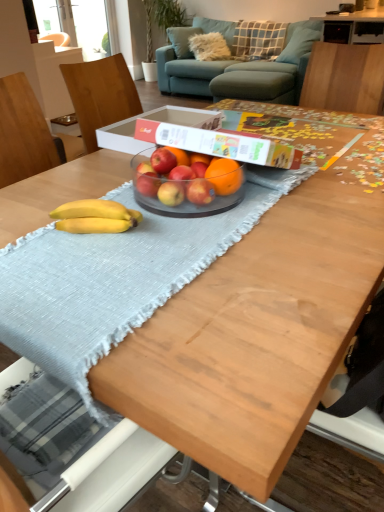
Question: From a real-world perspective, is blue fabric pillow at upper right, marked as the 1th pillow in a front-to-back arrangement, positioned under red matte apple at center, which is the second apple from left to right, based on gravity?

Choices:
 (A) yes
 (B) no

Answer: (A)

Question: Is blue fabric pillow at upper right, marked as the 1th pillow in a front-to-back arrangement, at the right side of red matte apple at center, which is the second apple from left to right?

Choices:
 (A) no
 (B) yes

Answer: (B)

Question: Is blue fabric pillow at upper right, the 2th pillow in the back-to-front sequence, outside red matte apple at center, the fourth apple viewed from the right?

Choices:
 (A) yes
 (B) no

Answer: (A)

Question: Can you confirm if blue fabric pillow at upper right, the 2th pillow in the back-to-front sequence, is thinner than red matte apple at center, the fourth apple viewed from the right?

Choices:
 (A) no
 (B) yes

Answer: (A)

Question: Does blue fabric pillow at upper right, the 2th pillow in the back-to-front sequence, have a larger size compared to red matte apple at center, the fourth apple viewed from the right?

Choices:
 (A) yes
 (B) no

Answer: (A)

Question: Considering the relative sizes of blue fabric pillow at upper right, marked as the 1th pillow in a front-to-back arrangement, and red matte apple at center, the fourth apple viewed from the right, in the image provided, is blue fabric pillow at upper right, marked as the 1th pillow in a front-to-back arrangement, shorter than red matte apple at center, the fourth apple viewed from the right,?

Choices:
 (A) yes
 (B) no

Answer: (B)

Question: Can you confirm if orange matte at center is positioned to the left of transparent glass window screen at upper left?

Choices:
 (A) yes
 (B) no

Answer: (B)

Question: Is there a large distance between orange matte at center and transparent glass window screen at upper left?

Choices:
 (A) no
 (B) yes

Answer: (B)

Question: Is orange matte at center surrounding transparent glass window screen at upper left?

Choices:
 (A) no
 (B) yes

Answer: (A)

Question: Does orange matte at center have a smaller size compared to transparent glass window screen at upper left?

Choices:
 (A) yes
 (B) no

Answer: (A)

Question: Can you confirm if orange matte at center is taller than transparent glass window screen at upper left?

Choices:
 (A) no
 (B) yes

Answer: (A)

Question: From the image's perspective, would you say orange matte at center is shown under transparent glass window screen at upper left?

Choices:
 (A) no
 (B) yes

Answer: (B)

Question: Are yellow matte bananas at center and red matte apple at center, acting as the fourth apple starting from the left, located far from each other?

Choices:
 (A) no
 (B) yes

Answer: (A)